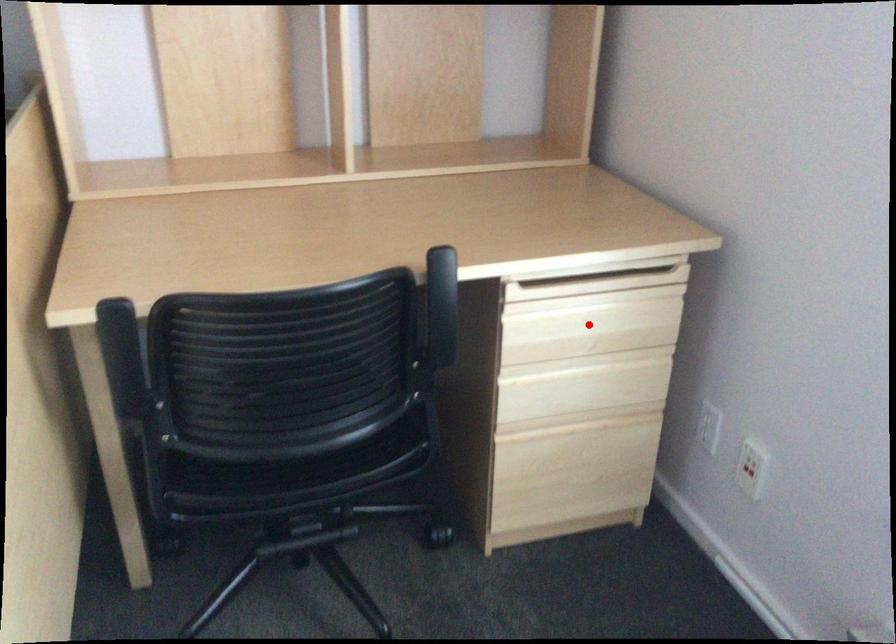
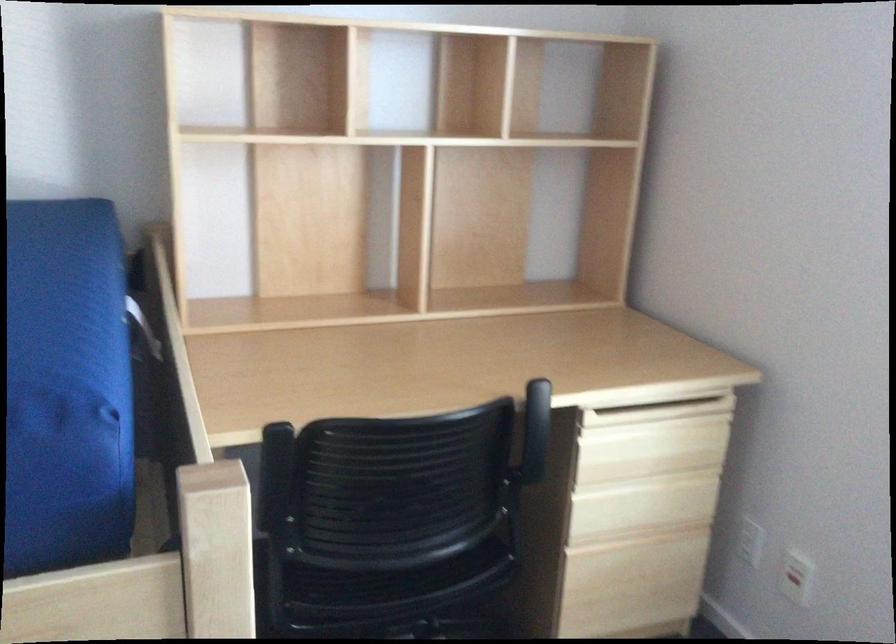
Where in the second image is the point corresponding to the highlighted location from the first image?

(650, 448)